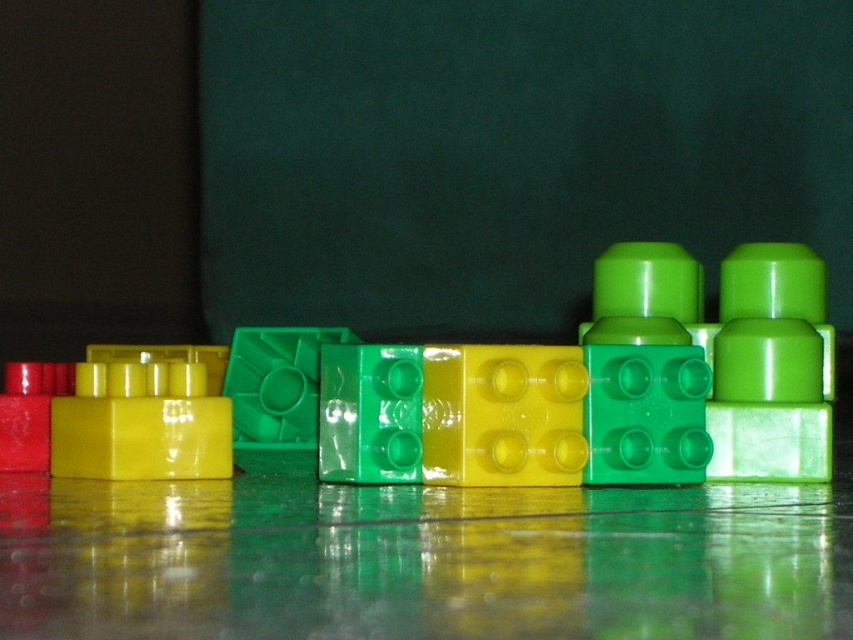
Does shiny yellow plastic block at left have a greater width compared to matte red block at left?

Correct, the width of shiny yellow plastic block at left exceeds that of matte red block at left.

Who is taller, shiny yellow plastic block at left or matte red block at left?

Standing taller between the two is shiny yellow plastic block at left.

Between point (224, 440) and point (45, 371), which one is positioned behind?

Positioned behind is point (45, 371).

You are a GUI agent. You are given a task and a screenshot of the screen. Output one action in this format:
    pyautogui.click(x=<x>, y=<y>)
    Task: Click on the shiny yellow plastic block at left
    Image resolution: width=853 pixels, height=640 pixels.
    Given the screenshot: What is the action you would take?
    pyautogui.click(x=143, y=417)

Is green plastic blocks at center shorter than shiny yellow plastic block at left?

No.

Can you confirm if green plastic blocks at center is smaller than shiny yellow plastic block at left?

No, green plastic blocks at center is not smaller than shiny yellow plastic block at left.

Does point (461, 368) come behind point (204, 444)?

No, (461, 368) is in front of (204, 444).

In order to click on green plastic blocks at center in this screenshot , I will do `click(526, 392)`.

Between green plastic blocks at center and matte red block at left, which one is positioned lower?

matte red block at left

Can you confirm if green plastic blocks at center is shorter than matte red block at left?

Incorrect, green plastic blocks at center's height does not fall short of matte red block at left's.

Is point (119, 428) more distant than point (22, 388)?

No.

Identify the location of green plastic blocks at center. (526, 392).